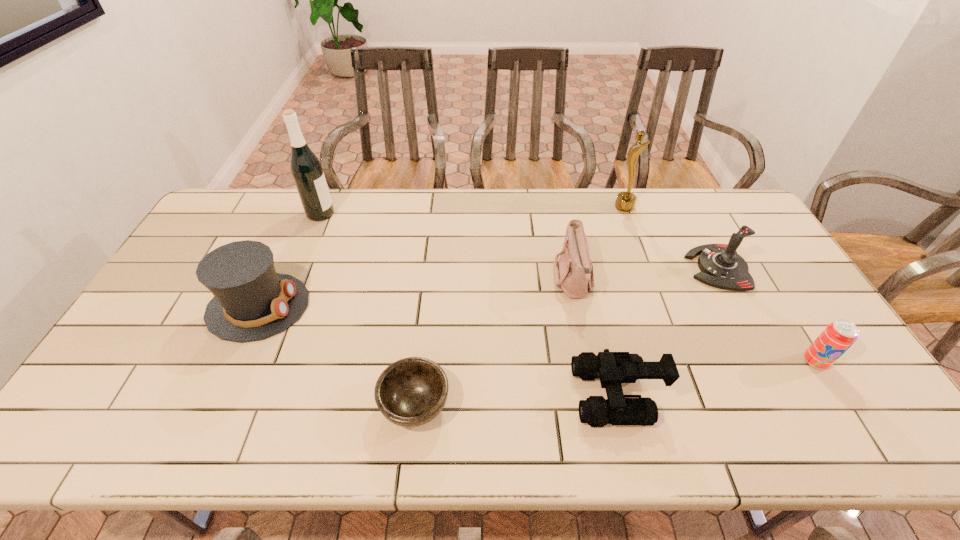
At what (x,y) coordinates should I click in order to perform the action: click on wine bottle. Please return your answer as a coordinate pair (x, y). The width and height of the screenshot is (960, 540). Looking at the image, I should click on (306, 169).

You are a GUI agent. You are given a task and a screenshot of the screen. Output one action in this format:
    pyautogui.click(x=<x>, y=<y>)
    Task: Click on the sixth object from left to right
    This screenshot has width=960, height=540.
    Given the screenshot: What is the action you would take?
    pyautogui.click(x=625, y=201)

Where is `award`? award is located at coordinates (625, 201).

Identify the location of dress hat. This screenshot has height=540, width=960. (251, 302).

At what (x,y) coordinates should I click in order to perform the action: click on joystick. Please return your answer as a coordinate pair (x, y). This screenshot has height=540, width=960. Looking at the image, I should click on (721, 266).

You are a GUI agent. You are given a task and a screenshot of the screen. Output one action in this format:
    pyautogui.click(x=<x>, y=<y>)
    Task: Click on the shoulder bag
    This screenshot has width=960, height=540.
    Given the screenshot: What is the action you would take?
    pyautogui.click(x=573, y=273)

Where is `soda can`? The height and width of the screenshot is (540, 960). soda can is located at coordinates (840, 335).

Where is `binoculars`? The height and width of the screenshot is (540, 960). binoculars is located at coordinates (612, 368).

The image size is (960, 540). I want to click on the sixth object from right to left, so click(x=410, y=392).

The image size is (960, 540). Find the location of `the shortest object`. the shortest object is located at coordinates (410, 392).